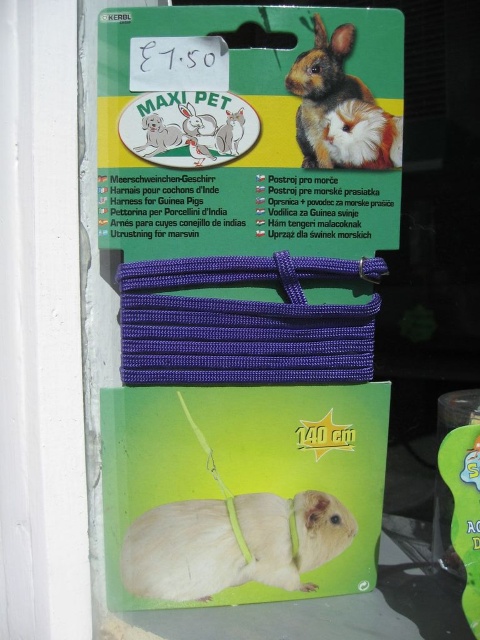
Question: Which of the following is the farthest from the observer?

Choices:
 (A) (350, 536)
 (B) (347, 51)

Answer: (A)

Question: Is white matte hamster at center below fluffy brown hamster at upper right?

Choices:
 (A) yes
 (B) no

Answer: (A)

Question: Which point is farther to the camera?

Choices:
 (A) coord(310,136)
 (B) coord(142,557)

Answer: (A)

Question: Is white matte hamster at center smaller than fluffy brown hamster at upper right?

Choices:
 (A) yes
 (B) no

Answer: (B)

Question: Is white matte hamster at center above fluffy brown hamster at upper right?

Choices:
 (A) no
 (B) yes

Answer: (A)

Question: Which object is closer to the camera taking this photo?

Choices:
 (A) fluffy brown hamster at upper right
 (B) white matte hamster at center

Answer: (A)